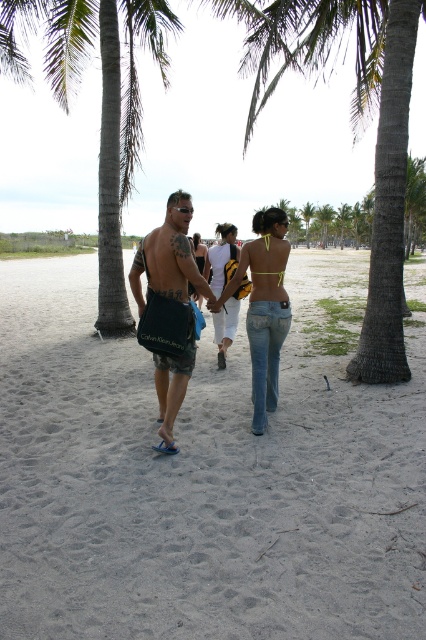
Does dark gray fabric bag at center appear on the left side of white cotton tank top at center?

Yes, dark gray fabric bag at center is to the left of white cotton tank top at center.

Does dark gray fabric bag at center appear under white cotton tank top at center?

No, dark gray fabric bag at center is not below white cotton tank top at center.

Measure the distance between dark gray fabric bag at center and camera.

The distance of dark gray fabric bag at center from camera is 4.77 meters.

Image resolution: width=426 pixels, height=640 pixels. I want to click on dark gray fabric bag at center, so click(169, 308).

What do you see at coordinates (354, 128) in the screenshot? The width and height of the screenshot is (426, 640). I see `gray textured trunk at right` at bounding box center [354, 128].

Can you confirm if gray textured trunk at right is bigger than green leafy palm tree at center?

Yes.

In order to click on gray textured trunk at right in this screenshot , I will do `click(354, 128)`.

This screenshot has width=426, height=640. Identify the location of gray textured trunk at right. (354, 128).

Between gray textured trunk at right and denim jeans at center, which one has more height?

Answer: gray textured trunk at right is taller.

Is gray textured trunk at right closer to camera compared to denim jeans at center?

No, it is behind denim jeans at center.

The height and width of the screenshot is (640, 426). Find the location of `gray textured trunk at right`. gray textured trunk at right is located at coordinates (354, 128).